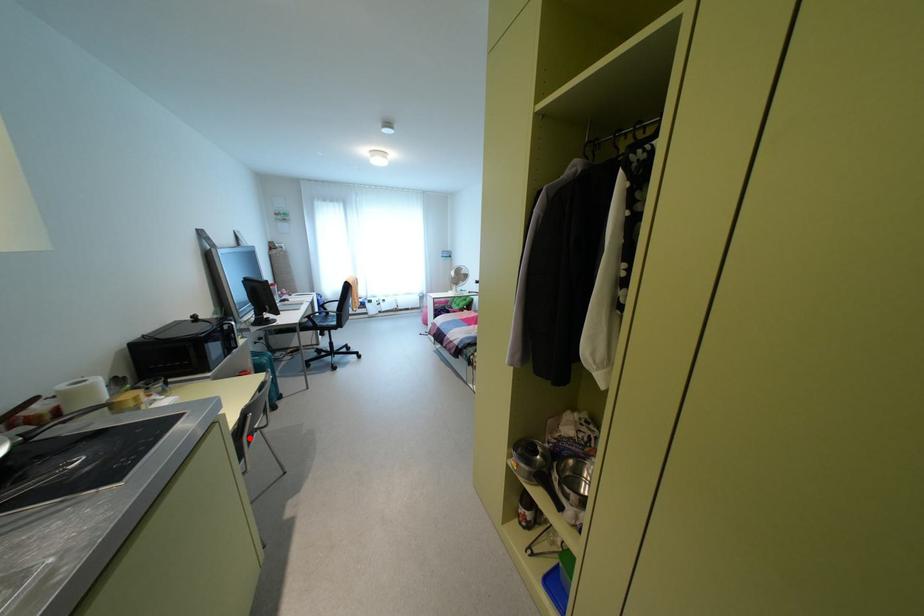
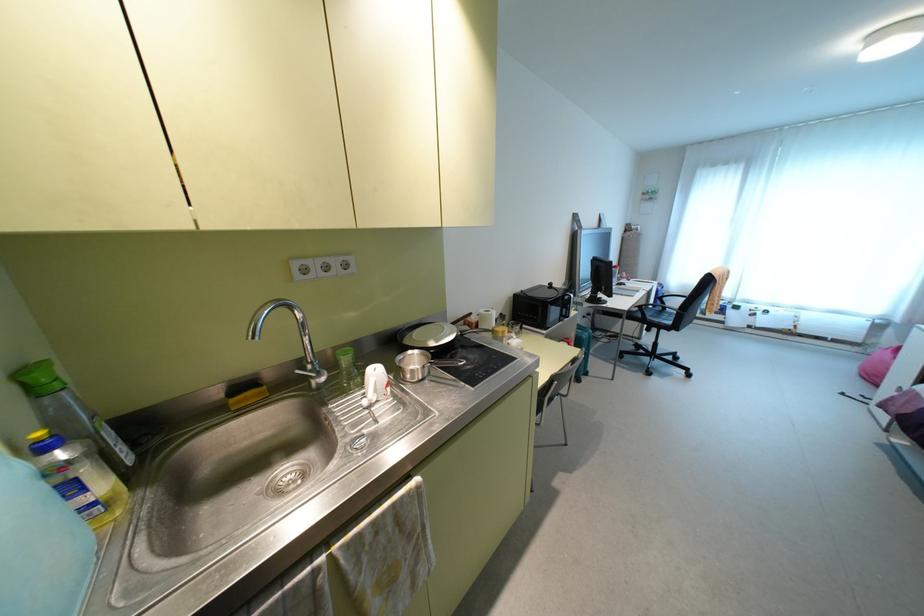
In the second image, find the point that corresponds to the highlighted location in the first image.

(551, 399)